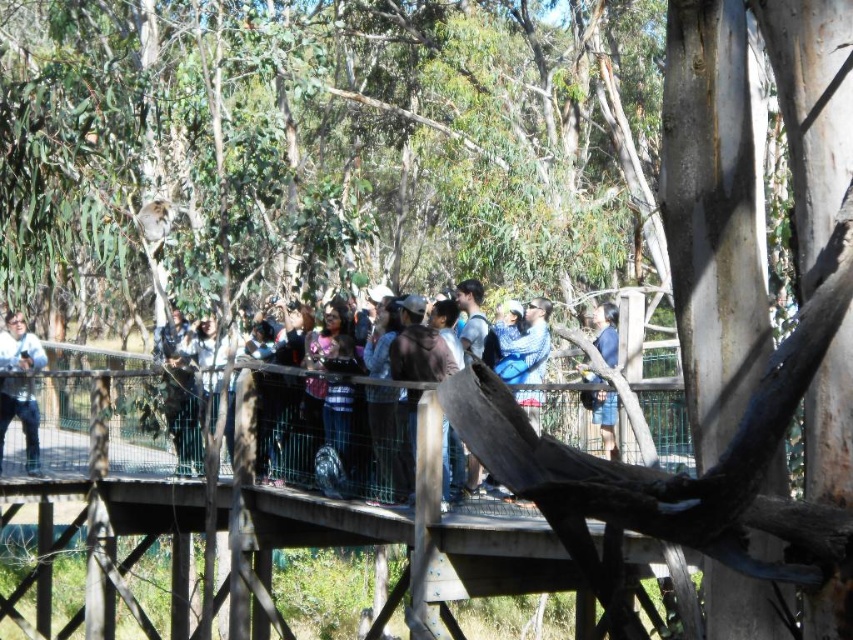
Is wooden bridge at center taller than dark blue shirt at center?

Correct, wooden bridge at center is much taller as dark blue shirt at center.

Is point (479, 579) more distant than point (518, 365)?

No, (479, 579) is closer to viewer.

The width and height of the screenshot is (853, 640). What are the coordinates of `wooden bridge at center` in the screenshot? It's located at (399, 538).

Which of these two, wooden bridge at center or blue denim shorts at center, stands taller?

With more height is wooden bridge at center.

Which is above, wooden bridge at center or blue denim shorts at center?

blue denim shorts at center is higher up.

The image size is (853, 640). What are the coordinates of `wooden bridge at center` in the screenshot? It's located at (399, 538).

Can you confirm if dark blue shirt at center is taller than matte black jacket at center?

Indeed, dark blue shirt at center has a greater height compared to matte black jacket at center.

Which is in front, point (346, 428) or point (166, 321)?

Point (346, 428) is in front.

This screenshot has width=853, height=640. Describe the element at coordinates (376, 346) in the screenshot. I see `dark blue shirt at center` at that location.

Where is `dark blue shirt at center`? dark blue shirt at center is located at coordinates (376, 346).